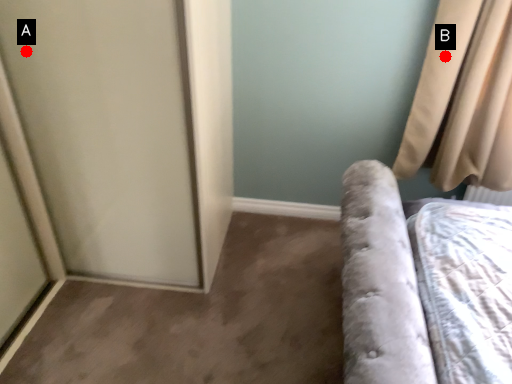
Question: Two points are circled on the image, labeled by A and B beside each circle. Among these points, which one is nearest to the camera?

Choices:
 (A) A is closer
 (B) B is closer

Answer: (A)